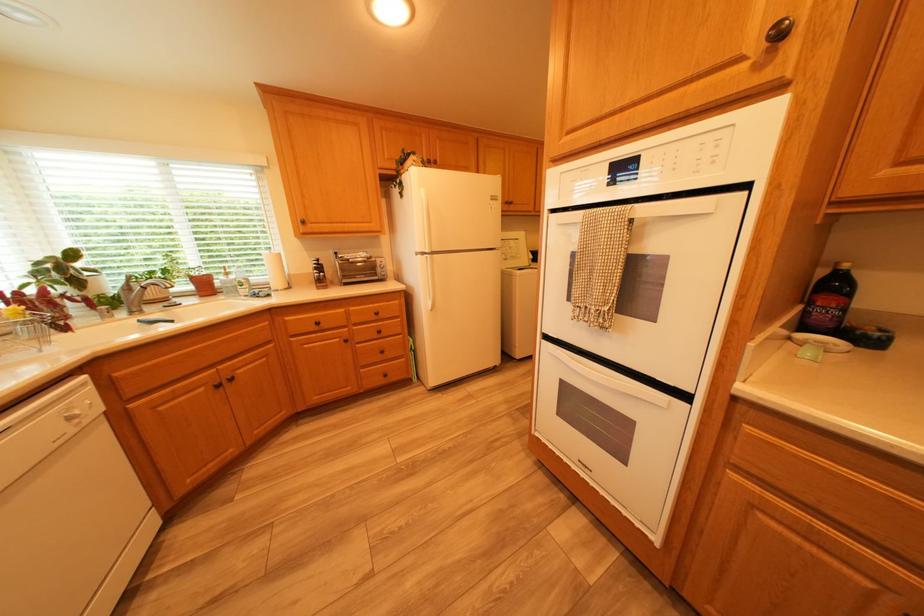
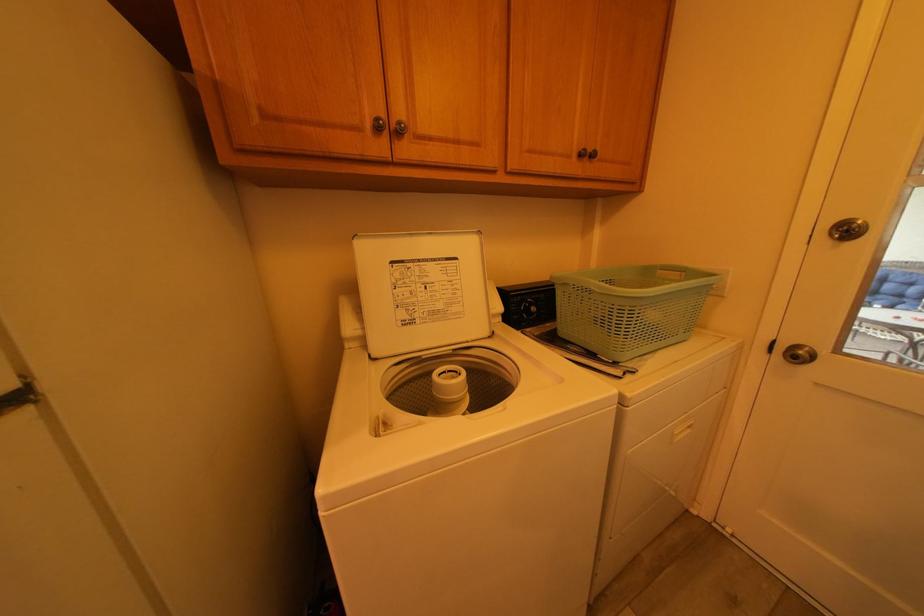
The images are taken continuously from a first-person perspective. In which direction are you moving?

The cameraman moved toward right, forward.